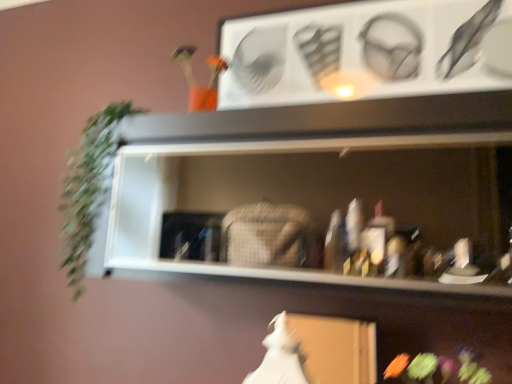
Question: Is white matte fancy dress at lower center facing away from white matte shelf at center?

Choices:
 (A) no
 (B) yes

Answer: (A)

Question: Is the surface of white matte fancy dress at lower center in direct contact with white matte shelf at center?

Choices:
 (A) no
 (B) yes

Answer: (A)

Question: Is the position of white matte fancy dress at lower center less distant than that of white matte shelf at center?

Choices:
 (A) yes
 (B) no

Answer: (B)

Question: Is white matte fancy dress at lower center positioned far away from white matte shelf at center?

Choices:
 (A) yes
 (B) no

Answer: (B)

Question: Does white matte fancy dress at lower center have a smaller size compared to white matte shelf at center?

Choices:
 (A) no
 (B) yes

Answer: (B)

Question: Is white matte fancy dress at lower center taller or shorter than white matte shelf at center?

Choices:
 (A) short
 (B) tall

Answer: (A)

Question: From the image's perspective, is white matte fancy dress at lower center positioned above or below white matte shelf at center?

Choices:
 (A) above
 (B) below

Answer: (B)

Question: Is white matte fancy dress at lower center wider or thinner than white matte shelf at center?

Choices:
 (A) thin
 (B) wide

Answer: (A)

Question: Considering the positions of white matte fancy dress at lower center and white matte shelf at center in the image, is white matte fancy dress at lower center bigger or smaller than white matte shelf at center?

Choices:
 (A) big
 (B) small

Answer: (B)

Question: From a real-world perspective, relative to white matte fancy dress at lower center, is green leafy plant at left vertically above or below?

Choices:
 (A) above
 (B) below

Answer: (A)

Question: Considering their positions, is green leafy plant at left located in front of or behind white matte fancy dress at lower center?

Choices:
 (A) behind
 (B) front

Answer: (A)

Question: Considering the positions of green leafy plant at left and white matte fancy dress at lower center in the image, is green leafy plant at left bigger or smaller than white matte fancy dress at lower center?

Choices:
 (A) big
 (B) small

Answer: (A)

Question: From their relative heights in the image, would you say green leafy plant at left is taller or shorter than white matte fancy dress at lower center?

Choices:
 (A) short
 (B) tall

Answer: (B)

Question: Looking at their shapes, would you say fluffy fabric flower at lower right is wider or thinner than white matte fancy dress at lower center?

Choices:
 (A) wide
 (B) thin

Answer: (A)

Question: In the image, is fluffy fabric flower at lower right on the left side or the right side of white matte fancy dress at lower center?

Choices:
 (A) right
 (B) left

Answer: (A)